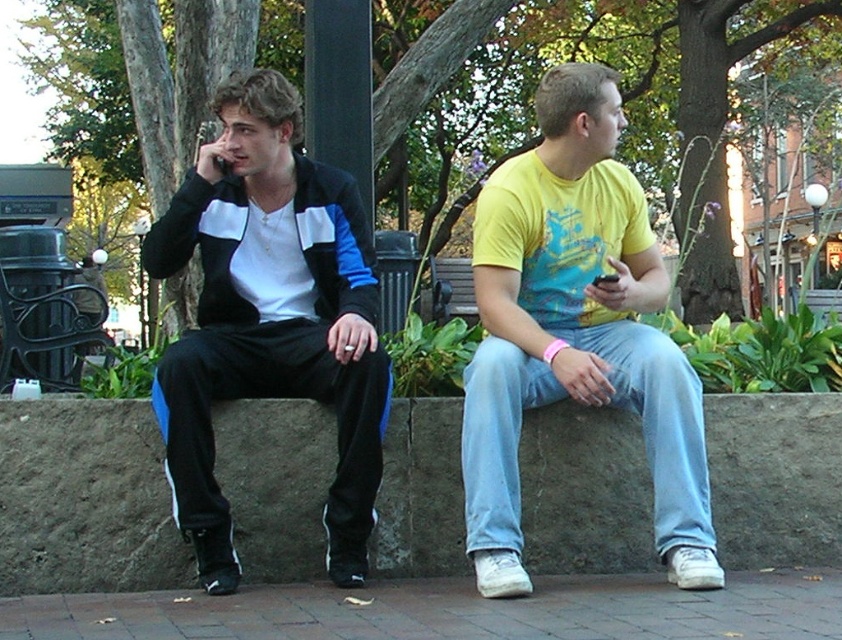
Question: Which is farther from the concrete curb at lower center?

Choices:
 (A) matte black tracksuit at left
 (B) yellow matte t-shirt at center

Answer: (B)

Question: Does concrete curb at lower center appear on the right side of yellow matte t-shirt at center?

Choices:
 (A) no
 (B) yes

Answer: (A)

Question: Where is concrete curb at lower center located in relation to matte black tracksuit at left in the image?

Choices:
 (A) right
 (B) left

Answer: (B)

Question: Which of these objects is positioned closest to the concrete curb at lower center?

Choices:
 (A) matte black tracksuit at left
 (B) yellow matte t-shirt at center

Answer: (A)

Question: Which of the following is the farthest from the observer?

Choices:
 (A) (600, 368)
 (B) (205, 257)
 (C) (789, 541)

Answer: (C)

Question: Is concrete curb at lower center positioned in front of yellow matte t-shirt at center?

Choices:
 (A) yes
 (B) no

Answer: (B)